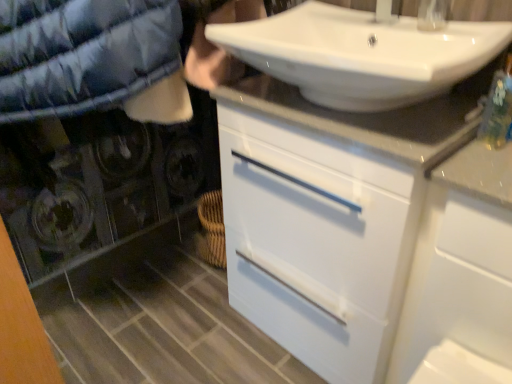
This screenshot has height=384, width=512. In order to click on free spot above white glossy cabinet at center (from a real-world perspective) in this screenshot , I will do `click(332, 108)`.